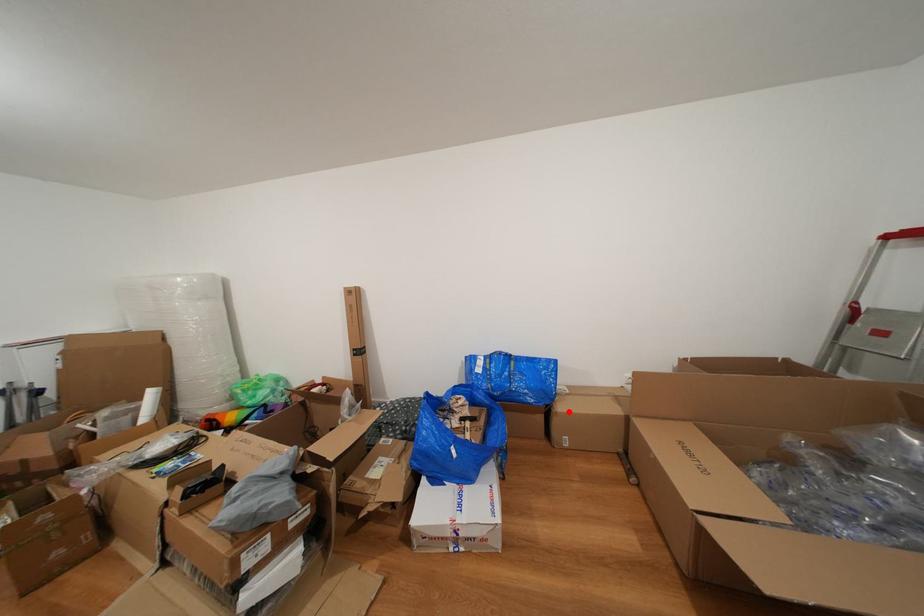
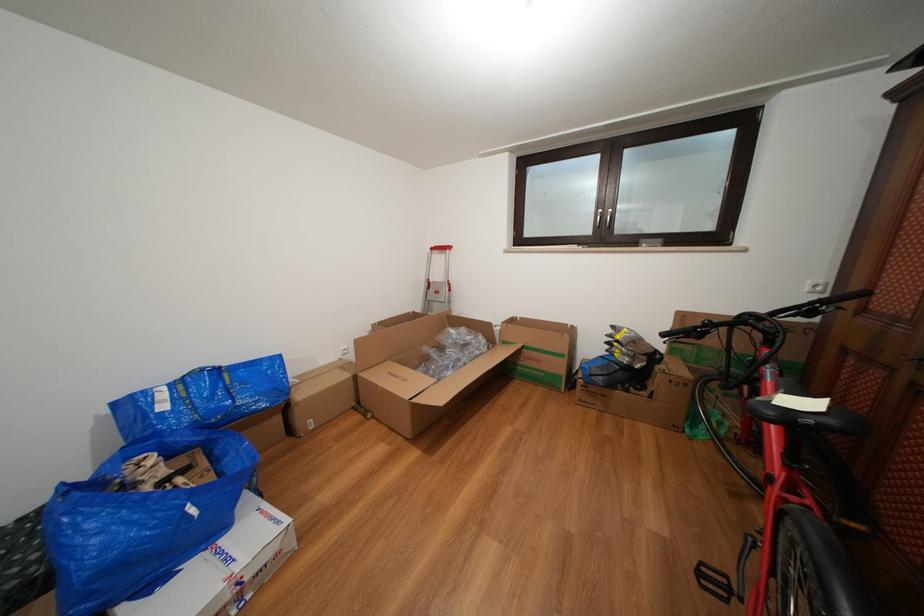
Question: I am providing you with two images of the same scene from different viewpoints. In image1, a red point is highlighted. Considering the same 3D point in image2, which of the following is correct?

Choices:
 (A) It is closer
 (B) It is farther

Answer: (A)